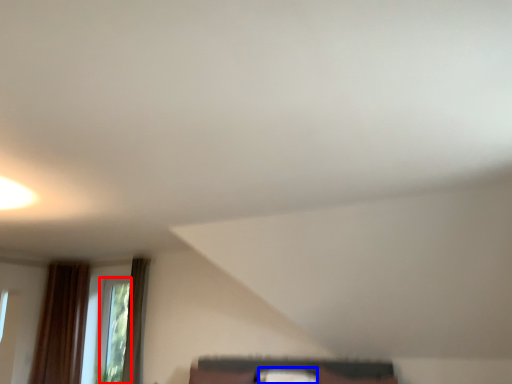
Question: Which object is closer to the camera taking this photo, window (highlighted by a red box) or pillow (highlighted by a blue box)?

Choices:
 (A) window
 (B) pillow

Answer: (B)